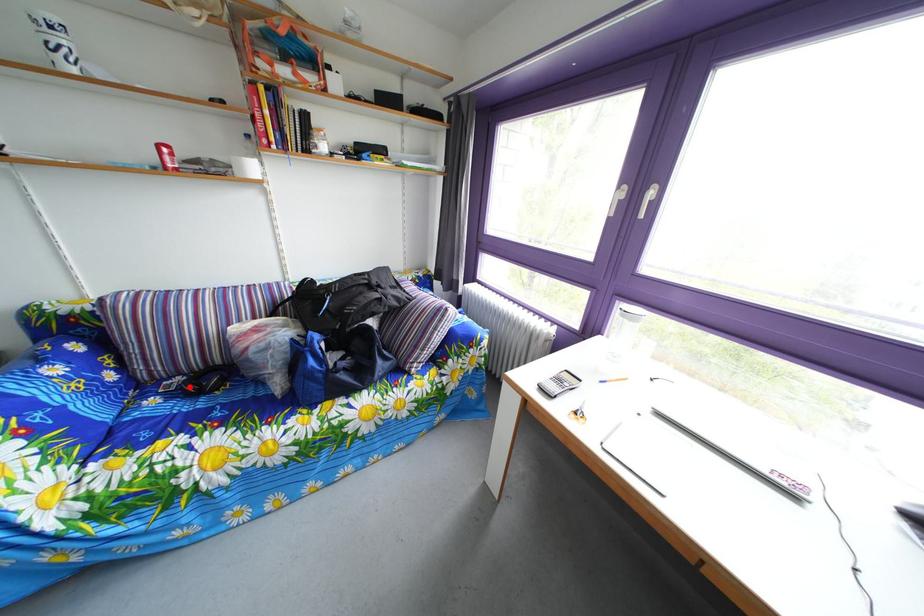
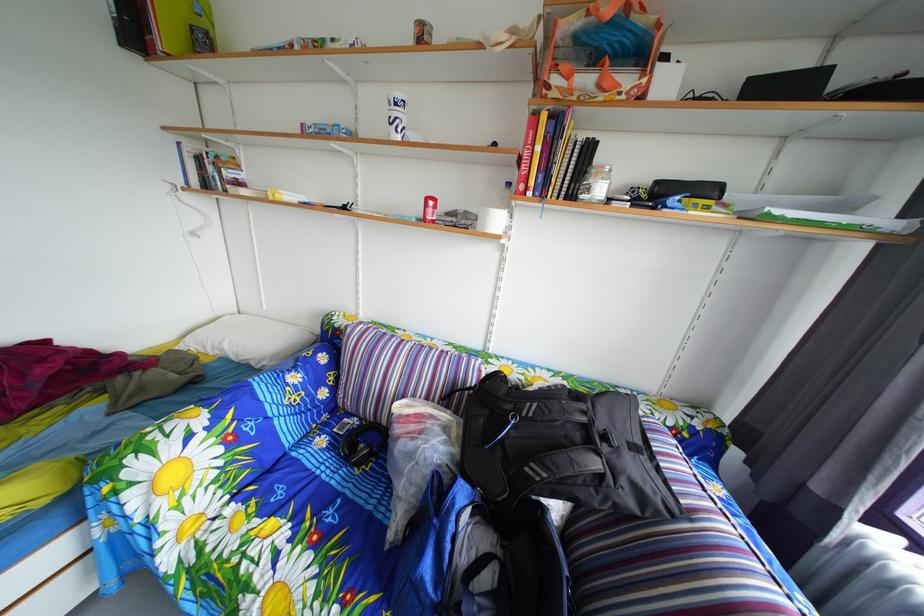
Question: A red point is marked in image1. In image2, is the corresponding 3D point closer to the camera or farther? Reply with the corresponding letter.

Choices:
 (A) The corresponding 3D point is closer.
 (B) The corresponding 3D point is farther.

Answer: (B)